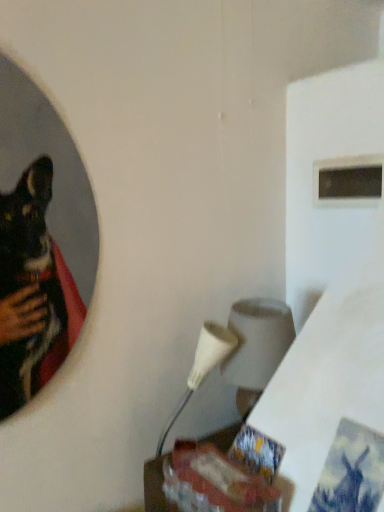
Question: From the image's perspective, does white matte lampshade at center-right appear lower than wooden table at lower center?

Choices:
 (A) yes
 (B) no

Answer: (B)

Question: Can you confirm if white matte lampshade at center-right is positioned to the left of wooden table at lower center?

Choices:
 (A) no
 (B) yes

Answer: (A)

Question: Does white matte lampshade at center-right have a greater height compared to wooden table at lower center?

Choices:
 (A) no
 (B) yes

Answer: (B)

Question: Considering the relative positions of white matte lampshade at center-right and wooden table at lower center in the image provided, is white matte lampshade at center-right in front of wooden table at lower center?

Choices:
 (A) no
 (B) yes

Answer: (A)

Question: Does white matte lampshade at center-right have a lesser height compared to wooden table at lower center?

Choices:
 (A) no
 (B) yes

Answer: (A)

Question: From the image's perspective, is white matte lampshade at center-right above or below black glossy mirror at upper left?

Choices:
 (A) below
 (B) above

Answer: (A)

Question: Looking at the image, does white matte lampshade at center-right seem bigger or smaller compared to black glossy mirror at upper left?

Choices:
 (A) small
 (B) big

Answer: (B)

Question: Is white matte lampshade at center-right in front of or behind black glossy mirror at upper left in the image?

Choices:
 (A) behind
 (B) front

Answer: (A)

Question: Is white matte lampshade at center-right taller or shorter than black glossy mirror at upper left?

Choices:
 (A) short
 (B) tall

Answer: (A)

Question: From a real-world perspective, is black glossy mirror at upper left positioned above or below white matte lampshade at center-right?

Choices:
 (A) below
 (B) above

Answer: (B)

Question: From their relative heights in the image, would you say black glossy mirror at upper left is taller or shorter than white matte lampshade at center-right?

Choices:
 (A) short
 (B) tall

Answer: (B)

Question: Looking at the image, does black glossy mirror at upper left seem bigger or smaller compared to white matte lampshade at center-right?

Choices:
 (A) small
 (B) big

Answer: (A)

Question: In terms of width, does black glossy mirror at upper left look wider or thinner when compared to white matte lampshade at center-right?

Choices:
 (A) thin
 (B) wide

Answer: (A)

Question: Is point (246, 336) closer or farther from the camera than point (233, 423)?

Choices:
 (A) farther
 (B) closer

Answer: (B)

Question: Choose the correct answer: Is white matte lampshade at center-right inside wooden table at lower center or outside it?

Choices:
 (A) inside
 (B) outside

Answer: (B)